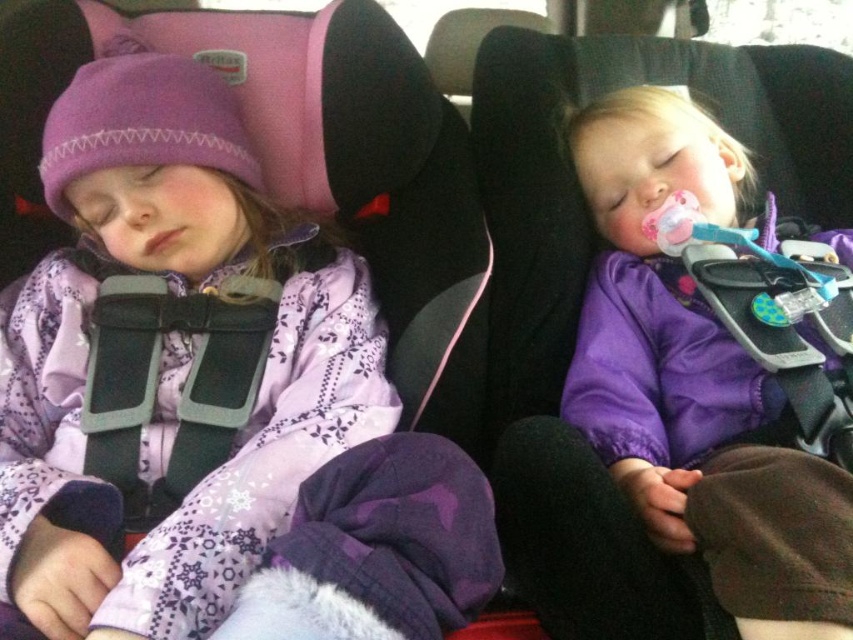
Question: Can you confirm if purple satin jacket at left is positioned above purple satin baby at center?

Choices:
 (A) no
 (B) yes

Answer: (A)

Question: Does purple satin jacket at left have a lesser width compared to purple satin baby at center?

Choices:
 (A) yes
 (B) no

Answer: (B)

Question: Which object is closer to the camera taking this photo?

Choices:
 (A) purple satin baby at center
 (B) purple satin jacket at left

Answer: (B)

Question: Does purple satin jacket at left have a larger size compared to purple satin baby at center?

Choices:
 (A) no
 (B) yes

Answer: (B)

Question: Which point is closer to the camera?

Choices:
 (A) purple satin jacket at left
 (B) purple satin baby at center

Answer: (A)